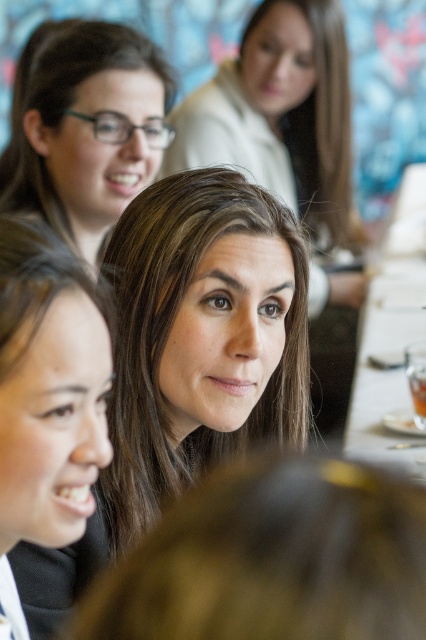
Does matte black glasses at upper left appear over white porcelain table at center?

Correct, matte black glasses at upper left is located above white porcelain table at center.

Can you confirm if matte black glasses at upper left is wider than white porcelain table at center?

No.

What do you see at coordinates (83, 128) in the screenshot? I see `matte black glasses at upper left` at bounding box center [83, 128].

The image size is (426, 640). In order to click on matte black glasses at upper left in this screenshot , I will do `click(83, 128)`.

Looking at this image, measure the distance between point (69, 166) and camera.

The distance of point (69, 166) from camera is 1.95 meters.

Is the position of matte black glasses at upper left more distant than that of smooth black hair at lower left?

Yes, it is.

Between point (48, 65) and point (36, 493), which one is positioned in front?

Point (36, 493) is in front.

Locate an element on the screen. matte black glasses at upper left is located at coordinates (83, 128).

Find the location of a particular element. The image size is (426, 640). smooth black hair at lower left is located at coordinates (46, 381).

The width and height of the screenshot is (426, 640). Describe the element at coordinates (46, 381) in the screenshot. I see `smooth black hair at lower left` at that location.

Find the location of `smooth black hair at lower left`. smooth black hair at lower left is located at coordinates (46, 381).